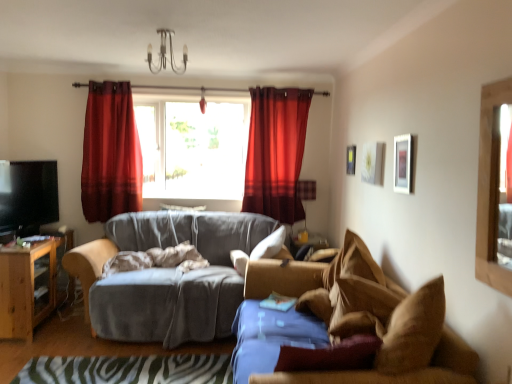
What do you see at coordinates (345, 324) in the screenshot? I see `brown fabric couch at right, which appears as the second studio couch when viewed from the back` at bounding box center [345, 324].

Where is `matte silver picture frame at upper right, which is the third picture frame from back to front`? The width and height of the screenshot is (512, 384). matte silver picture frame at upper right, which is the third picture frame from back to front is located at coordinates (403, 163).

What do you see at coordinates (27, 286) in the screenshot? This screenshot has height=384, width=512. I see `wooden cabinet at left` at bounding box center [27, 286].

In order to click on white matte picture frame at upper center, which is the 2th picture frame from back to front in this screenshot , I will do `click(372, 163)`.

At what (x,y) coordinates should I click in order to perform the action: click on zebra print rug at lower center. Please return your answer as a coordinate pair (x, y). The image size is (512, 384). Looking at the image, I should click on (128, 370).

This screenshot has height=384, width=512. I want to click on brown fabric couch at right, which appears as the second studio couch when viewed from the back, so click(345, 324).

From a real-world perspective, between metallic chandelier at upper center and velvet grey couch at center, which is the 1th studio couch from back to front, who is vertically lower?

From a 3D spatial view, velvet grey couch at center, which is the 1th studio couch from back to front, is below.

Who is taller, metallic chandelier at upper center or velvet grey couch at center, which ranks as the second studio couch in front-to-back order?

Standing taller between the two is velvet grey couch at center, which ranks as the second studio couch in front-to-back order.

Measure the distance from metallic chandelier at upper center to velvet grey couch at center, which ranks as the second studio couch in front-to-back order.

metallic chandelier at upper center is 5.65 feet from velvet grey couch at center, which ranks as the second studio couch in front-to-back order.

Is black glossy tv at left inside metallic chandelier at upper center?

No, black glossy tv at left is located outside of metallic chandelier at upper center.

The width and height of the screenshot is (512, 384). What are the coordinates of `television located on the left of metallic chandelier at upper center` in the screenshot? It's located at (28, 196).

From the image's perspective, which one is positioned higher, metallic chandelier at upper center or black glossy tv at left?

From the image's view, metallic chandelier at upper center is above.

Is metallic chandelier at upper center at the left side of black glossy tv at left?

No, metallic chandelier at upper center is not to the left of black glossy tv at left.

Does matte silver picture frame at upper right, arranged as the 1th picture frame when viewed from the front, have a lesser height compared to matte black lampshade at center?

Indeed, matte silver picture frame at upper right, arranged as the 1th picture frame when viewed from the front, has a lesser height compared to matte black lampshade at center.

Which object is positioned more to the left, matte silver picture frame at upper right, which is the third picture frame from back to front, or matte black lampshade at center?

matte black lampshade at center.

How different are the orientations of matte silver picture frame at upper right, which is the third picture frame from back to front, and matte black lampshade at center in degrees?

88.8 degrees separate the facing orientations of matte silver picture frame at upper right, which is the third picture frame from back to front, and matte black lampshade at center.

Which object is thinner, matte silver picture frame at upper right, arranged as the 1th picture frame when viewed from the front, or matte black lampshade at center?

Thinner between the two is matte silver picture frame at upper right, arranged as the 1th picture frame when viewed from the front.

From the image's perspective, which object appears higher, white matte picture frame at upper center, which appears as the second picture frame when viewed from the front, or velvet red curtain at upper center, the 2th curtain viewed from the right?

velvet red curtain at upper center, the 2th curtain viewed from the right, from the image's perspective.

Is point (369, 149) closer or farther from the camera than point (125, 187)?

Point (369, 149) appears to be closer to the viewer than point (125, 187).

Who is shorter, white matte picture frame at upper center, which is the 2th picture frame from back to front, or velvet red curtain at upper center, the first curtain viewed from the left?

white matte picture frame at upper center, which is the 2th picture frame from back to front, is shorter.

Is white matte picture frame at upper center, which is the 2th picture frame from back to front, aimed at velvet red curtain at upper center, the first curtain viewed from the left?

No, white matte picture frame at upper center, which is the 2th picture frame from back to front, is not aimed at velvet red curtain at upper center, the first curtain viewed from the left.

Does white matte picture frame at upper center, which appears as the second picture frame when viewed from the front, have a lesser width compared to zebra print rug at lower center?

Yes, white matte picture frame at upper center, which appears as the second picture frame when viewed from the front, is thinner than zebra print rug at lower center.

Looking at this image, is white matte picture frame at upper center, which is the 2th picture frame from back to front, facing towards zebra print rug at lower center?

No, white matte picture frame at upper center, which is the 2th picture frame from back to front, is not oriented towards zebra print rug at lower center.

From the image's perspective, which one is positioned higher, white matte picture frame at upper center, which appears as the second picture frame when viewed from the front, or zebra print rug at lower center?

white matte picture frame at upper center, which appears as the second picture frame when viewed from the front, from the image's perspective.

Could you measure the distance between white matte picture frame at upper center, which is the 2th picture frame from back to front, and zebra print rug at lower center?

white matte picture frame at upper center, which is the 2th picture frame from back to front, and zebra print rug at lower center are 6.91 feet apart from each other.

Looking at this image, who is bigger, matte black lampshade at center or zebra print rug at lower center?

With larger size is zebra print rug at lower center.

Is matte black lampshade at center spatially inside zebra print rug at lower center, or outside of it?

matte black lampshade at center is outside zebra print rug at lower center.

Considering the sizes of objects matte black lampshade at center and zebra print rug at lower center in the image provided, who is shorter, matte black lampshade at center or zebra print rug at lower center?

zebra print rug at lower center is shorter.

Is matte black lampshade at center far away from zebra print rug at lower center?

That's right, there is a large distance between matte black lampshade at center and zebra print rug at lower center.

Relative to brown fabric couch at right, the 1th studio couch when ordered from front to back, is velvet grey couch at center, which is the 1th studio couch from back to front, in front or behind?

Clearly, velvet grey couch at center, which is the 1th studio couch from back to front, is behind brown fabric couch at right, the 1th studio couch when ordered from front to back.

From the image's perspective, is velvet grey couch at center, which is the 1th studio couch from back to front, on brown fabric couch at right, the 1th studio couch when ordered from front to back?

Correct, velvet grey couch at center, which is the 1th studio couch from back to front, appears higher than brown fabric couch at right, the 1th studio couch when ordered from front to back, in the image.

From a real-world perspective, is velvet grey couch at center, which is the 1th studio couch from back to front, positioned above or below brown fabric couch at right, which appears as the second studio couch when viewed from the back?

Clearly, from a real-world perspective, velvet grey couch at center, which is the 1th studio couch from back to front, is above brown fabric couch at right, which appears as the second studio couch when viewed from the back.

Find the location of a particular element. The width and height of the screenshot is (512, 384). the 1st studio couch positioned below the metallic chandelier at upper center (from a real-world perspective) is located at coordinates (169, 277).

Where is `light fixture lying in front of the black glossy tv at left`? The width and height of the screenshot is (512, 384). light fixture lying in front of the black glossy tv at left is located at coordinates (165, 54).

When comparing their distances from matte black picture frame at upper center, which is the 3th picture frame in front-to-back order, does matte red curtain at center, the first curtain in the right-to-left sequence, or white soft pillow at center seem closer?

matte red curtain at center, the first curtain in the right-to-left sequence.

From the picture: From the image, which object appears to be nearer to beige soft blanket at center, matte red curtain at center, arranged as the second curtain when viewed from the left, or metallic chandelier at upper center?

matte red curtain at center, arranged as the second curtain when viewed from the left.

Estimate the real-world distances between objects in this image. Which object is closer to velvet red curtain at upper center, the 2th curtain viewed from the right, velvet grey couch at center, which ranks as the second studio couch in front-to-back order, or matte black lampshade at center?

velvet grey couch at center, which ranks as the second studio couch in front-to-back order.

Based on their spatial positions, is black glossy tv at left or zebra print rug at lower center further from white soft pillow at center?

Based on the image, black glossy tv at left appears to be further to white soft pillow at center.

Looking at the image, which one is located further to matte black picture frame at upper center, arranged as the first picture frame when viewed from the back, zebra print rug at lower center or beige soft blanket at center?

Among the two, zebra print rug at lower center is located further to matte black picture frame at upper center, arranged as the first picture frame when viewed from the back.

Estimate the real-world distances between objects in this image. Which object is closer to matte black lampshade at center, metallic chandelier at upper center or white matte picture frame at upper center, which is the 2th picture frame from back to front?

white matte picture frame at upper center, which is the 2th picture frame from back to front, lies closer to matte black lampshade at center than the other object.

Based on their spatial positions, is matte black lampshade at center or brown fabric couch at right, which appears as the second studio couch when viewed from the back, closer to matte silver picture frame at upper right, arranged as the 1th picture frame when viewed from the front?

brown fabric couch at right, which appears as the second studio couch when viewed from the back, is positioned closer to the anchor matte silver picture frame at upper right, arranged as the 1th picture frame when viewed from the front.

Estimate the real-world distances between objects in this image. Which object is further from velvet red curtain at upper center, the 2th curtain viewed from the right, matte silver picture frame at upper right, which is the third picture frame from back to front, or brown fabric couch at right, the 1th studio couch when ordered from front to back?

matte silver picture frame at upper right, which is the third picture frame from back to front, is positioned further to the anchor velvet red curtain at upper center, the 2th curtain viewed from the right.

Find the location of `pillow situated between black glossy tv at left and matte red curtain at center, the first curtain in the right-to-left sequence, from left to right`. pillow situated between black glossy tv at left and matte red curtain at center, the first curtain in the right-to-left sequence, from left to right is located at coordinates (262, 251).

The image size is (512, 384). In order to click on pillow situated between black glossy tv at left and matte silver picture frame at upper right, which is the third picture frame from back to front, from left to right in this screenshot , I will do `click(262, 251)`.

Identify the location of pillow between white matte picture frame at upper center, which appears as the second picture frame when viewed from the front, and matte red curtain at center, arranged as the second curtain when viewed from the left, in the front-back direction. The height and width of the screenshot is (384, 512). (262, 251).

The width and height of the screenshot is (512, 384). Find the location of `plain between black glossy tv at left and white soft pillow at center in the horizontal direction`. plain between black glossy tv at left and white soft pillow at center in the horizontal direction is located at coordinates (128, 370).